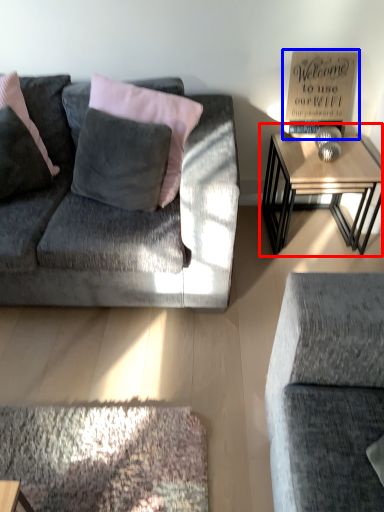
Question: Which object appears closest to the camera in this image, table (highlighted by a red box) or bulletin board (highlighted by a blue box)?

Choices:
 (A) table
 (B) bulletin board

Answer: (A)